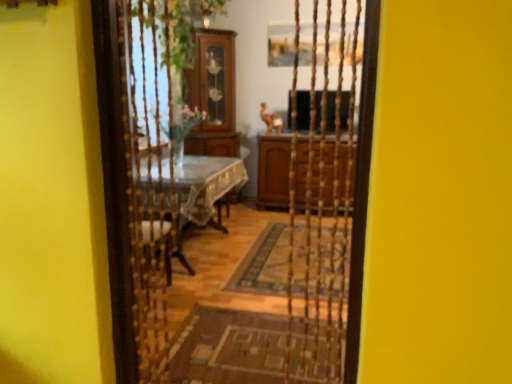
Question: From a real-world perspective, does brown woven mat at center sit lower than brown wood cabinet at center?

Choices:
 (A) no
 (B) yes

Answer: (B)

Question: Is brown woven mat at center to the right of brown wood cabinet at center from the viewer's perspective?

Choices:
 (A) no
 (B) yes

Answer: (A)

Question: From the image's perspective, is brown woven mat at center on brown wood cabinet at center?

Choices:
 (A) yes
 (B) no

Answer: (B)

Question: Can you confirm if brown woven mat at center is positioned to the left of brown wood cabinet at center?

Choices:
 (A) yes
 (B) no

Answer: (A)

Question: Is brown woven mat at center turned away from brown wood cabinet at center?

Choices:
 (A) no
 (B) yes

Answer: (A)

Question: Considering the relative sizes of brown woven mat at center and brown wood cabinet at center in the image provided, is brown woven mat at center bigger than brown wood cabinet at center?

Choices:
 (A) yes
 (B) no

Answer: (B)

Question: Could you tell me if brown wood cabinet at center is facing brown woven mat at center?

Choices:
 (A) yes
 (B) no

Answer: (A)

Question: Is brown wood cabinet at center not within brown woven mat at center?

Choices:
 (A) yes
 (B) no

Answer: (A)

Question: Does brown wood cabinet at center come in front of brown woven mat at center?

Choices:
 (A) no
 (B) yes

Answer: (A)

Question: Can you confirm if brown wood cabinet at center is positioned to the left of brown woven mat at center?

Choices:
 (A) no
 (B) yes

Answer: (A)

Question: From a real-world perspective, is brown wood cabinet at center located beneath brown woven mat at center?

Choices:
 (A) no
 (B) yes

Answer: (A)

Question: Is brown wood cabinet at center next to brown woven mat at center?

Choices:
 (A) yes
 (B) no

Answer: (B)

Question: From a real-world perspective, is brown wood cabinet at center physically located above or below brown woven mat at center?

Choices:
 (A) above
 (B) below

Answer: (A)